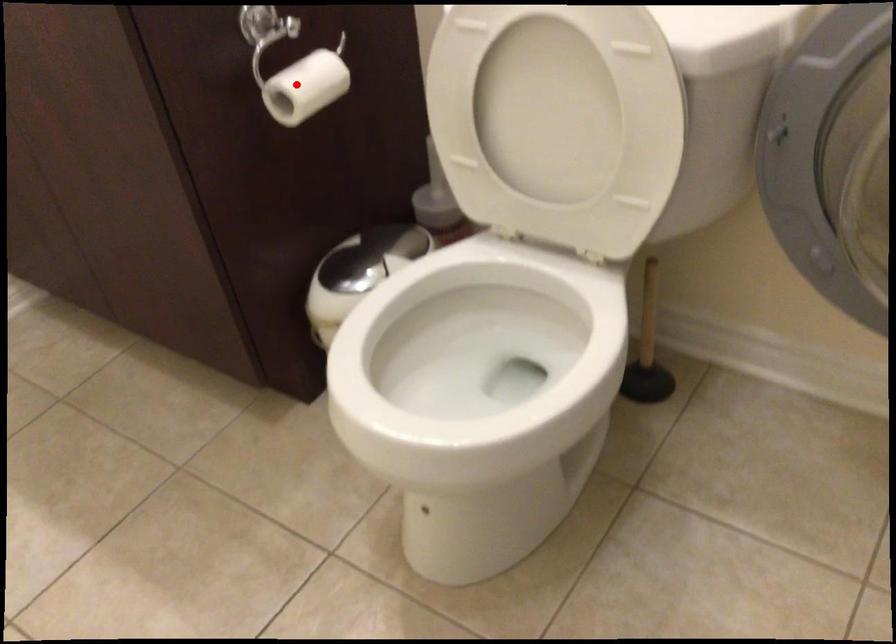
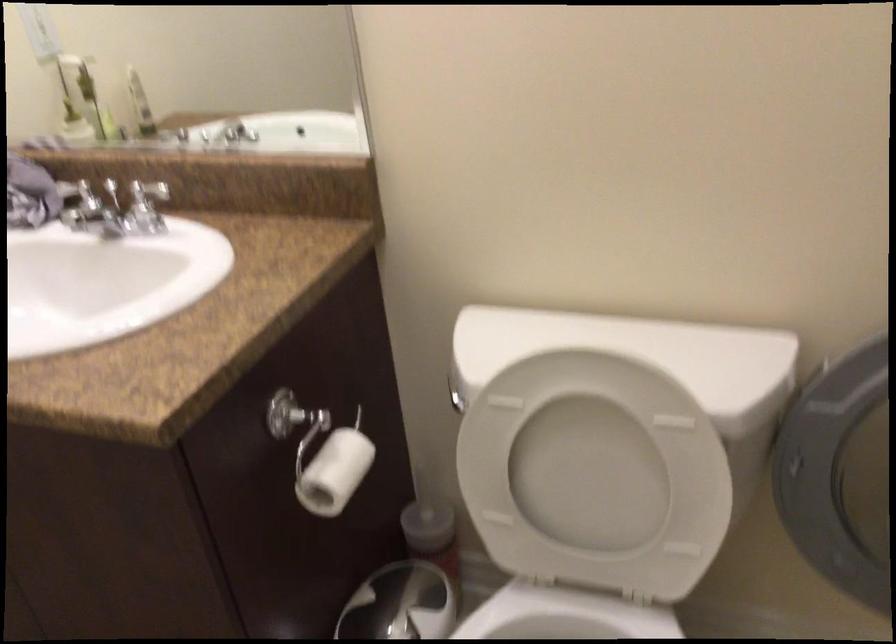
Where in the second image is the point corresponding to the highlighted location from the first image?

(334, 471)